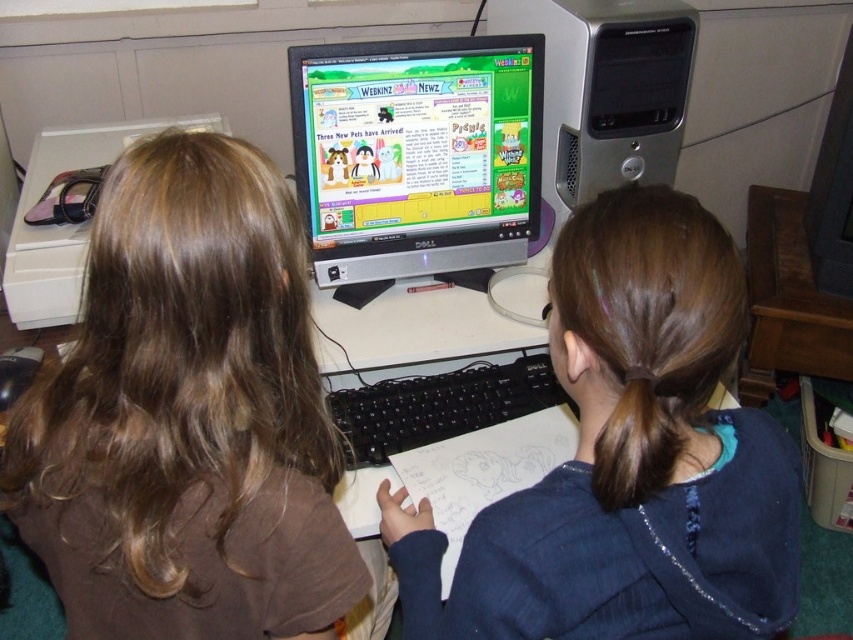
Consider the image. You are a web developer working on a website layout. You need to place a new button exactly at the point labeled as point (x=187, y=416). According to the scene, where should this button be placed in relation to the brown matte hair at upper left?

The point labeled as point (x=187, y=416) is on the brown matte hair at upper left, so the button should be placed directly on the brown matte hair at upper left.

You are a parent trying to help your child with homework. You need to adjust the angle of the matte silver monitor at center so that it faces the dark blue sweater at center. Is the monitor currently positioned above or below the sweater?

The dark blue sweater at center is below the matte silver monitor at center, so the monitor is currently positioned above the sweater.